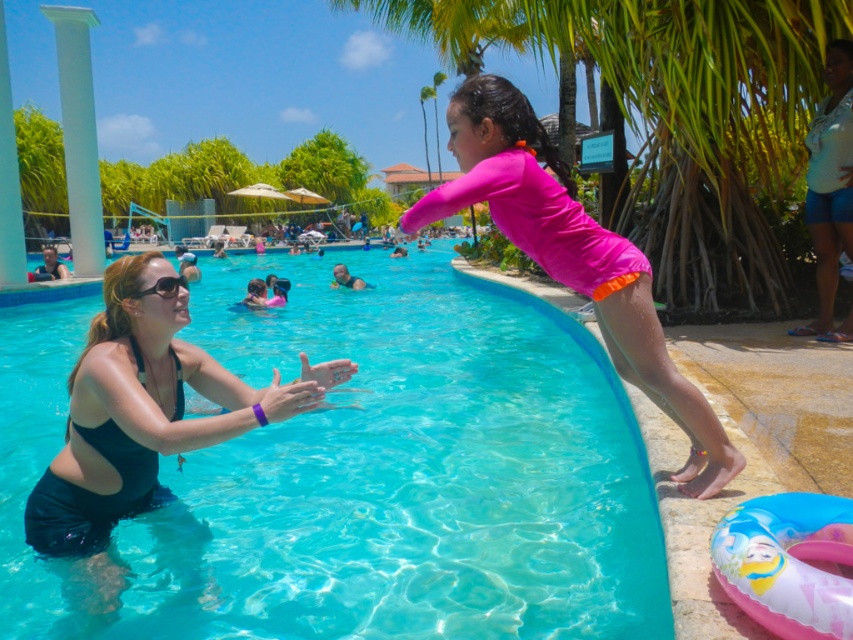
Is transparent plastic pool at center to the right of blue denim shorts at right from the viewer's perspective?

No, transparent plastic pool at center is not to the right of blue denim shorts at right.

Between transparent plastic pool at center and blue denim shorts at right, which one has more height?

blue denim shorts at right

The image size is (853, 640). Identify the location of transparent plastic pool at center. click(363, 470).

Who is shorter, transparent plastic pool at center or black matte swimsuit at left?

With less height is black matte swimsuit at left.

Can you confirm if transparent plastic pool at center is taller than black matte swimsuit at left?

Yes, transparent plastic pool at center is taller than black matte swimsuit at left.

Who is more forward, [573,428] or [99,560]?

Point [99,560] is more forward.

I want to click on transparent plastic pool at center, so click(x=363, y=470).

Between green leafy palm tree at upper center and blue denim shorts at right, which one is positioned lower?

blue denim shorts at right

Is point (755, 260) closer to viewer compared to point (836, 337)?

No.

The image size is (853, 640). Identify the location of green leafy palm tree at upper center. (671, 115).